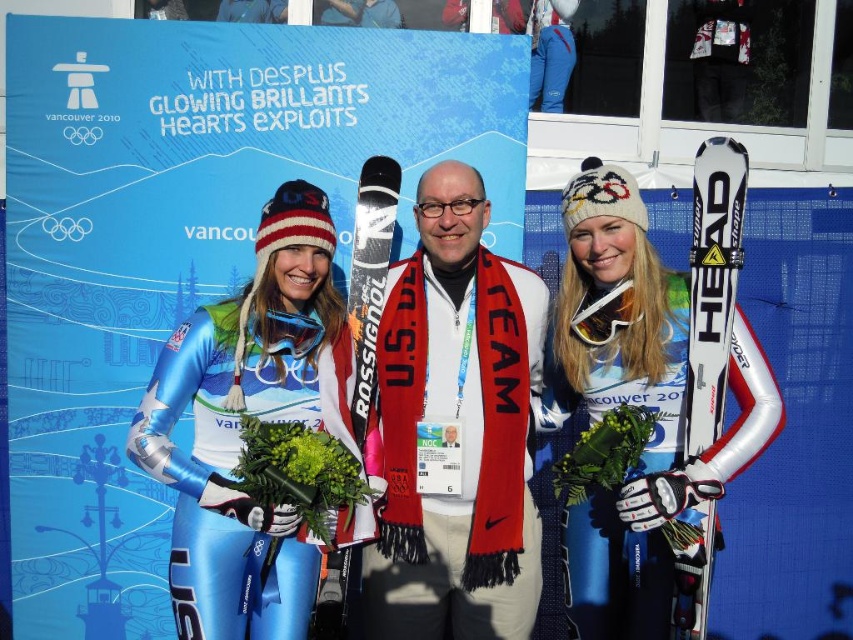
You are a photographer at the Vancouver 2010 Winter Olympics. You need to position yourself so that you can capture both the metallic blue ski suit at center and the black matte ski at center in the same frame. Based on their positions, which object should you focus on first to ensure both are in the shot?

The metallic blue ski suit at center is to the right of the black matte ski at center. To capture both in the same frame, you should focus on the black matte ski at center first, as it is on the left side, allowing the camera to adjust to include the metallic blue ski suit at center to its right.

You are an athlete at the Vancouver 2010 Winter Olympics. You notice the metallic blue ski suit at center and the black matte ski at center in the image. Which object is positioned lower in the scene?

The metallic blue ski suit at center is positioned below the black matte ski at center, so it is lower in the scene.

You are a photographer at the Vancouver 2010 Winter Olympics. You need to place a small flag exactly at the point marked by the coordinates point (x=368, y=413). Where on the image should you place it?

The point (x=368, y=413) is located on the metallic blue ski suit at center, so you should place the flag there.